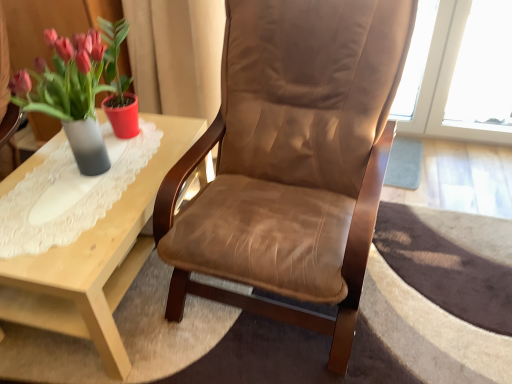
Image resolution: width=512 pixels, height=384 pixels. In order to click on vacant space to the right of brown leather chair at center in this screenshot , I will do `click(431, 254)`.